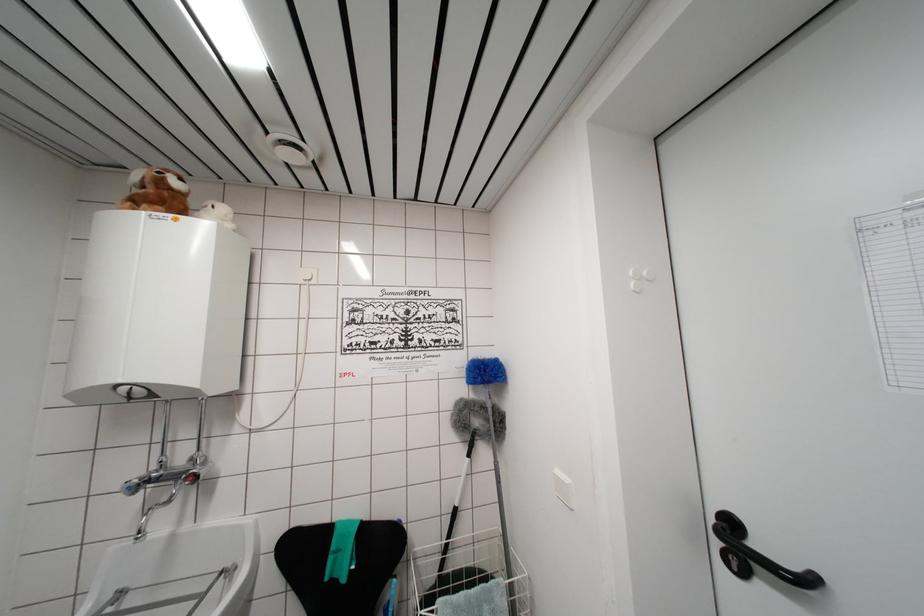
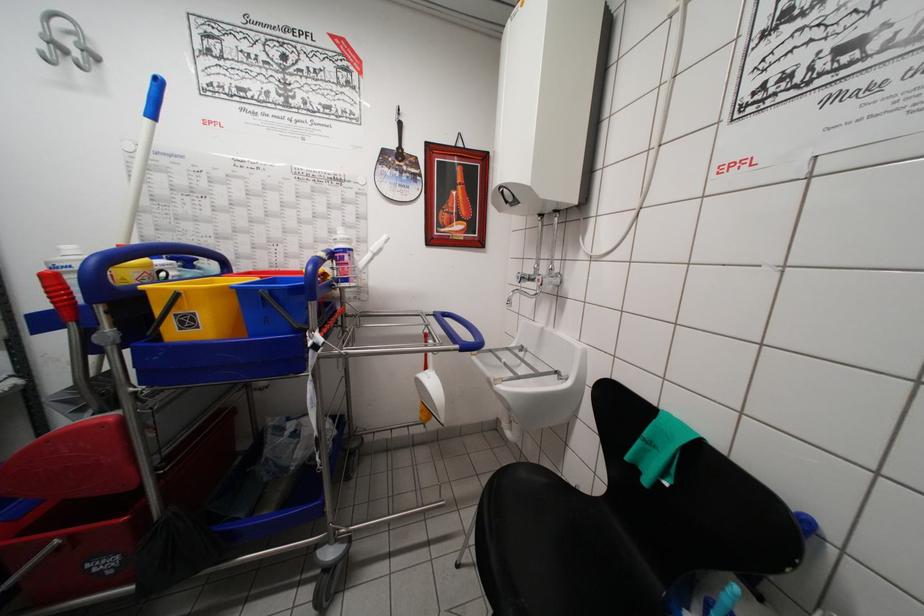
The point at (x=132, y=493) is marked in the first image. Where is the corresponding point in the second image?

(521, 282)